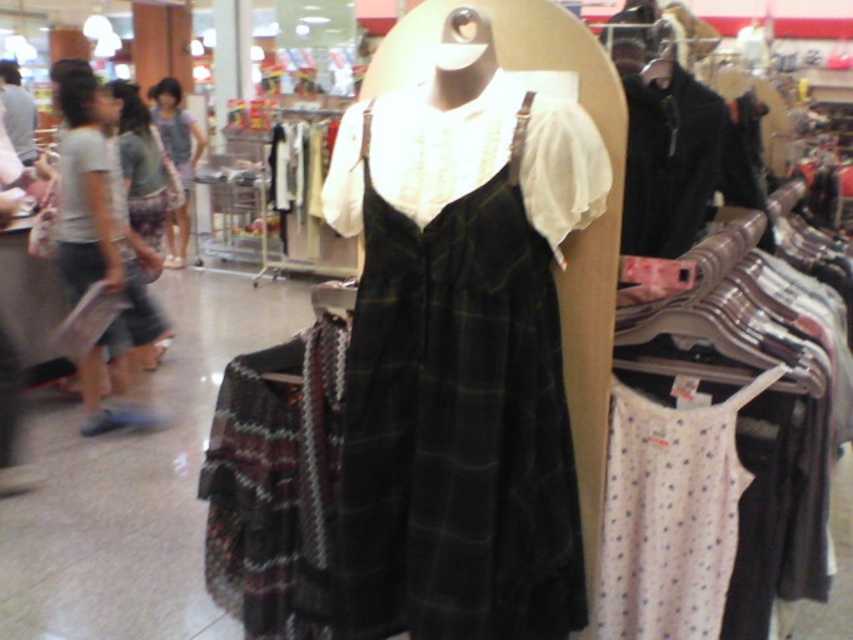
Can you confirm if dark green plaid dress at center is taller than matte gray shirt at left?

No.

Is dark green plaid dress at center to the left of matte gray shirt at left from the viewer's perspective?

In fact, dark green plaid dress at center is to the right of matte gray shirt at left.

Find the location of a particular element. Image resolution: width=853 pixels, height=640 pixels. dark green plaid dress at center is located at coordinates (456, 422).

Where is `dark green plaid dress at center`? The height and width of the screenshot is (640, 853). dark green plaid dress at center is located at coordinates (456, 422).

Does black wool coat at upper right appear over matte purple scarf at center?

No, black wool coat at upper right is not above matte purple scarf at center.

Describe the element at coordinates (682, 164) in the screenshot. I see `black wool coat at upper right` at that location.

The image size is (853, 640). I want to click on black wool coat at upper right, so click(682, 164).

The image size is (853, 640). I want to click on black wool coat at upper right, so click(682, 164).

Does dark green plaid dress at center appear over white dotted fabric at lower right?

Yes, dark green plaid dress at center is above white dotted fabric at lower right.

This screenshot has height=640, width=853. I want to click on dark green plaid dress at center, so click(x=456, y=422).